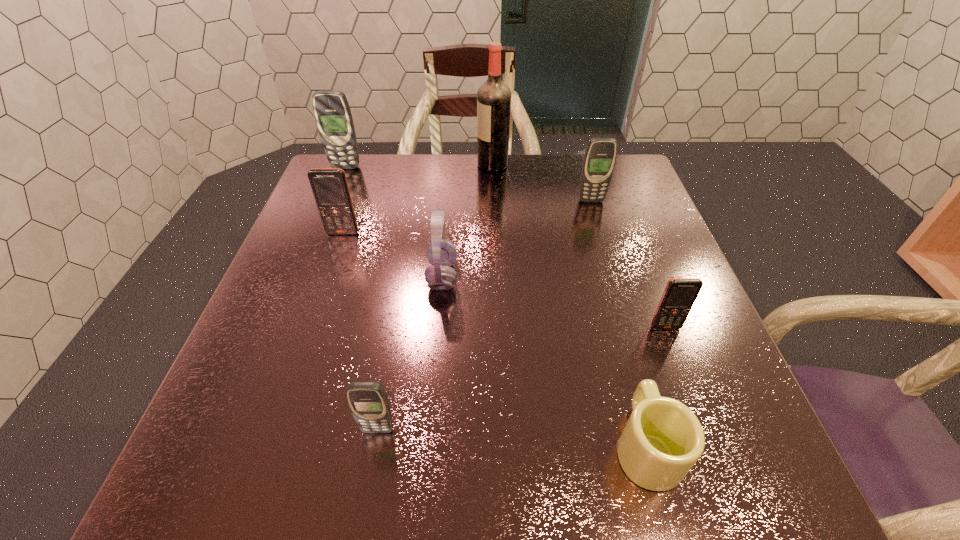
I want to click on liquor, so click(493, 97).

Identify the location of the fifth object from left to right. (493, 97).

In order to click on the seventh shortest object in this screenshot , I will do `click(332, 112)`.

At what (x,y) coordinates should I click in order to perform the action: click on the leftmost gray cellular telephone. Please return your answer as a coordinate pair (x, y). The width and height of the screenshot is (960, 540). Looking at the image, I should click on (332, 112).

Identify the location of the fourth cellular telephone from left to right. The width and height of the screenshot is (960, 540). pyautogui.click(x=600, y=156).

The height and width of the screenshot is (540, 960). What are the coordinates of `the fourth nearest cellular telephone` in the screenshot? It's located at (600, 156).

Where is `the bigger orange cellular telephone`? This screenshot has height=540, width=960. the bigger orange cellular telephone is located at coordinates (330, 188).

This screenshot has width=960, height=540. Find the location of `the third farthest cellular telephone`. the third farthest cellular telephone is located at coordinates (330, 188).

Where is `the fourth nearest object`? This screenshot has height=540, width=960. the fourth nearest object is located at coordinates (442, 253).

At what (x,y) coordinates should I click in order to perform the action: click on headset. Please return your answer as a coordinate pair (x, y). Image resolution: width=960 pixels, height=540 pixels. Looking at the image, I should click on (442, 253).